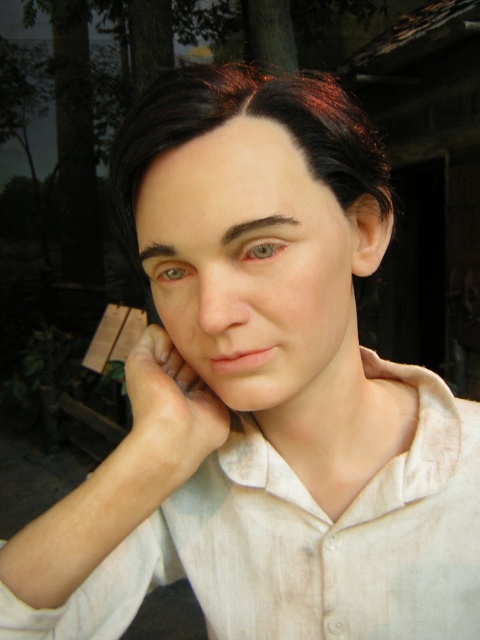
Based on the coordinates provided, where exactly is the smooth skin hand at center located in the image?

The smooth skin hand at center is located at coordinates point [167,417].

You are an artist trying to sketch the person in the image. The point at coordinates point (167, 417) marks the center of the hand resting on the cheek. Since the hand is at center, where should you focus your attention to capture the subject accurately?

The point (167, 417) marks the smooth skin hand at center, so you should focus on the hand resting on the cheek at the center to capture the subject accurately.